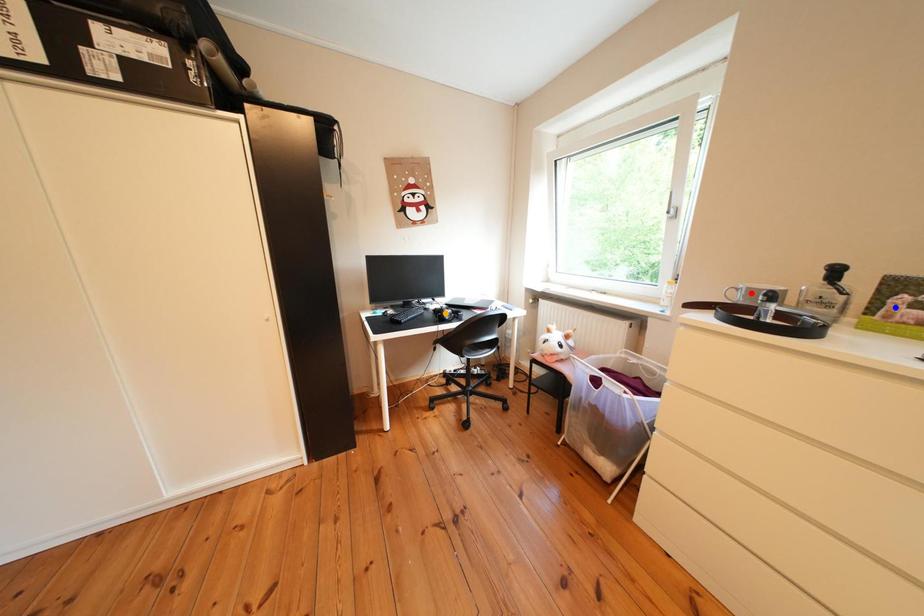
Order these from nearest to farthest:
blue point, red point, orange point

orange point < red point < blue point